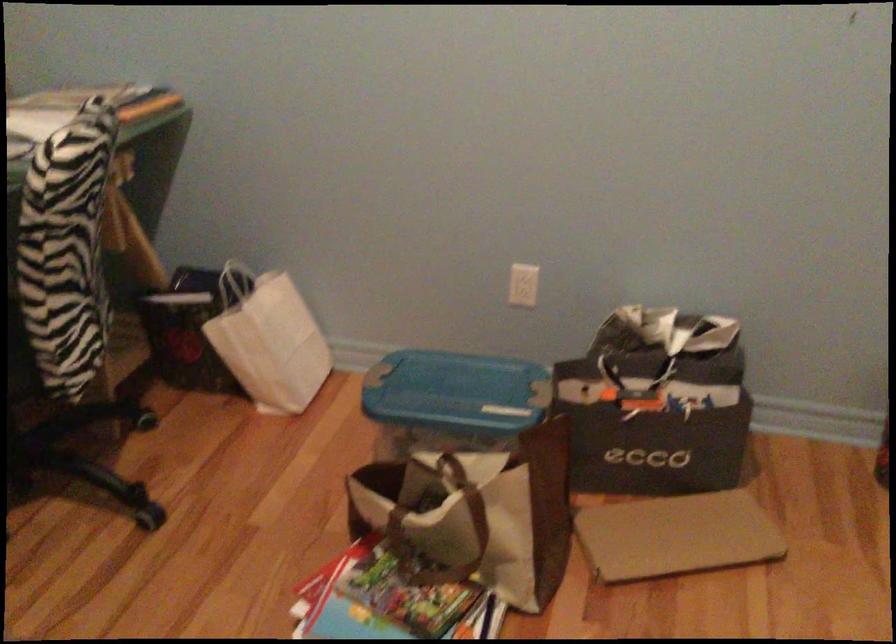
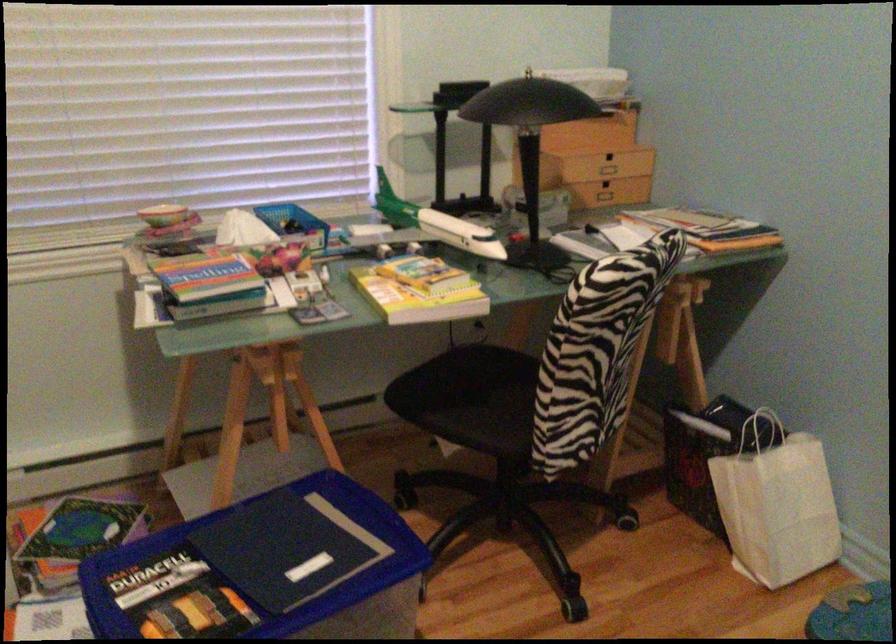
The point at (237, 288) is marked in the first image. Where is the corresponding point in the second image?

(761, 431)